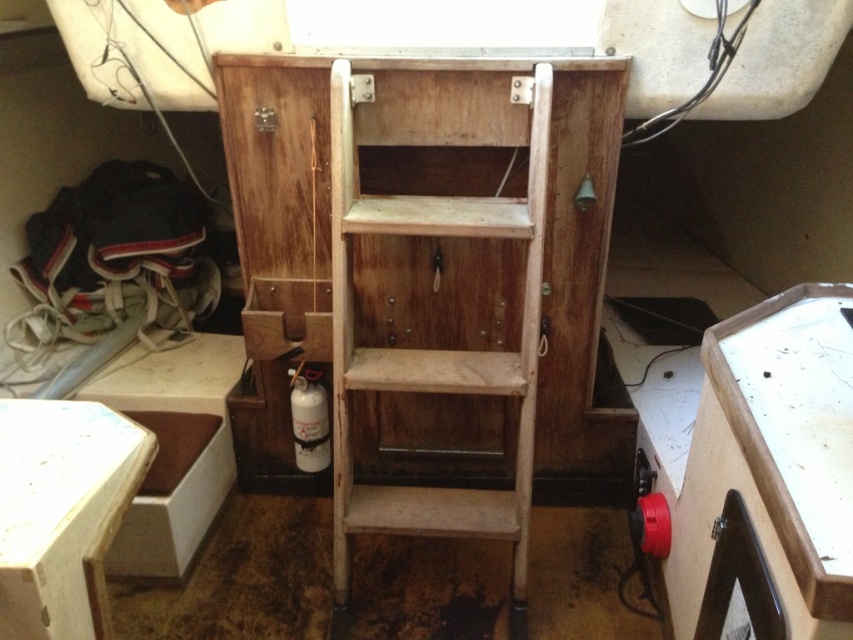
You are organizing the storage area and need to move the white matte gas canister at lower center. Where is the white matte stool at lower left located in relation to it?

The white matte stool at lower left is positioned on the left side of the white matte gas canister at lower center.

Based on the photo, you are a maintenance worker who needs to reach the wooden drawer at center to retrieve a tool. You have a white matte stool at lower left. Can you use the stool to reach the drawer if you stand on it?

The distance between the white matte stool at lower left and the wooden drawer at center is 25.21 inches. Since the stool is at a distance, you would need to move it closer to the drawer to use it effectively for reaching.

You are organizing items in a small cabin. You have a white matte stool at lower left and a wooden drawer at center. Which item is closer to the left wall?

The white matte stool at lower left is closer to the left wall because it is positioned on the left side of the wooden drawer at center.